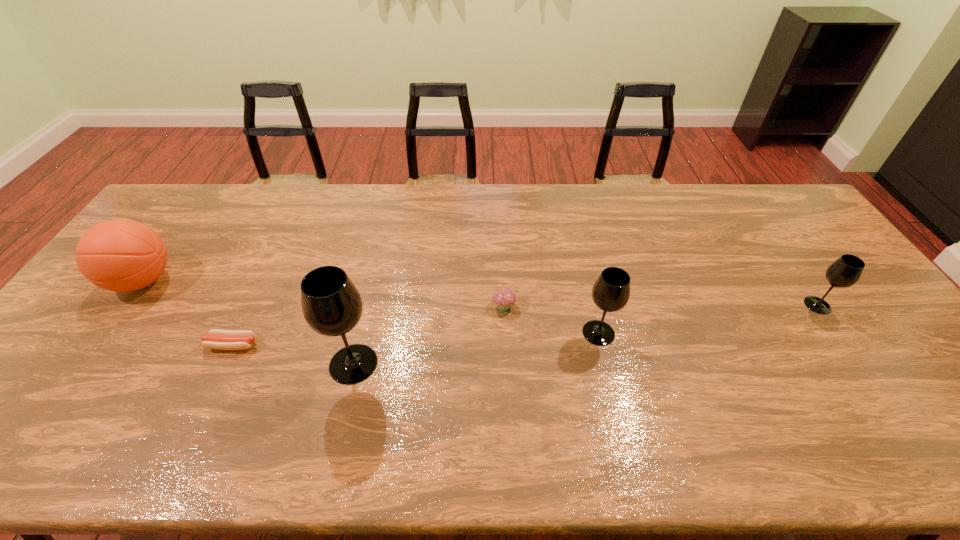
Please point a spot to add another wineglass on the left. Please provide its 2D coordinates. Your answer should be formatted as a tuple, i.e. [(x, y)], where the tuple contains the x and y coordinates of a point satisfying the conditions above.

[(77, 399)]